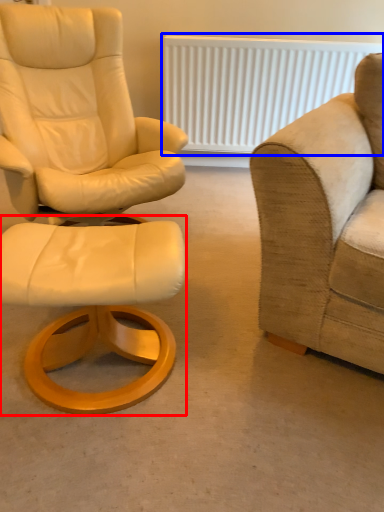
Question: Which object appears farthest to the camera in this image, stool (highlighted by a red box) or radiator (highlighted by a blue box)?

Choices:
 (A) stool
 (B) radiator

Answer: (B)